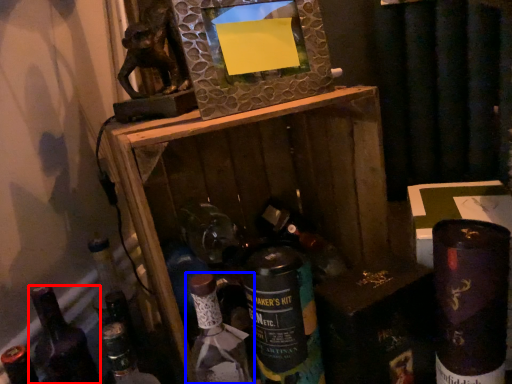
Question: Which of the following is the closest to the observer, bottle (highlighted by a red box) or bottle (highlighted by a blue box)?

Choices:
 (A) bottle
 (B) bottle

Answer: (B)